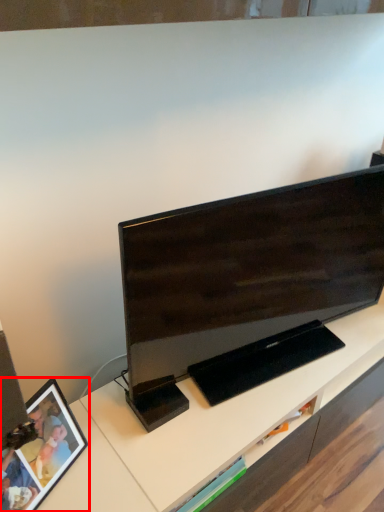
Question: Observing the image, what is the correct spatial positioning of picture frame (annotated by the red box) in reference to television?

Choices:
 (A) right
 (B) left

Answer: (B)